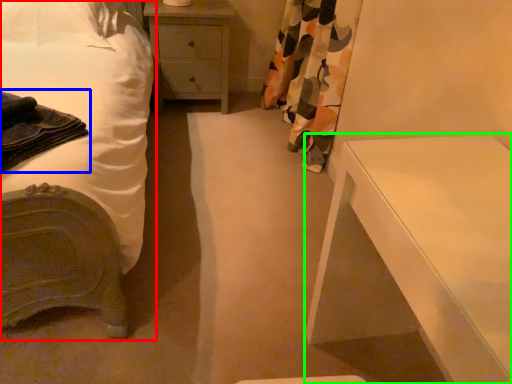
Question: Based on their relative distances, which object is nearer to bed (highlighted by a red box)? Choose from material (highlighted by a blue box) and nightstand (highlighted by a green box).

Choices:
 (A) material
 (B) nightstand

Answer: (A)